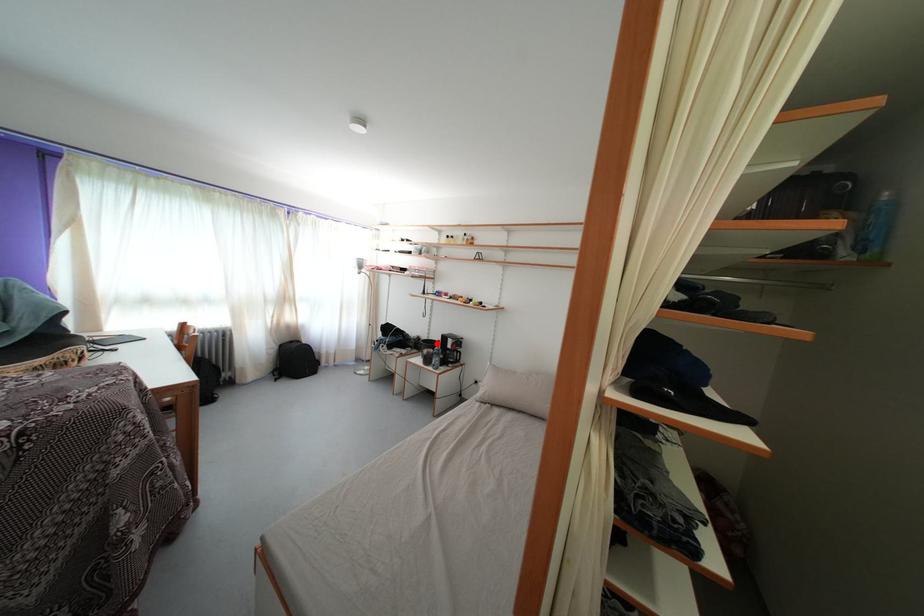
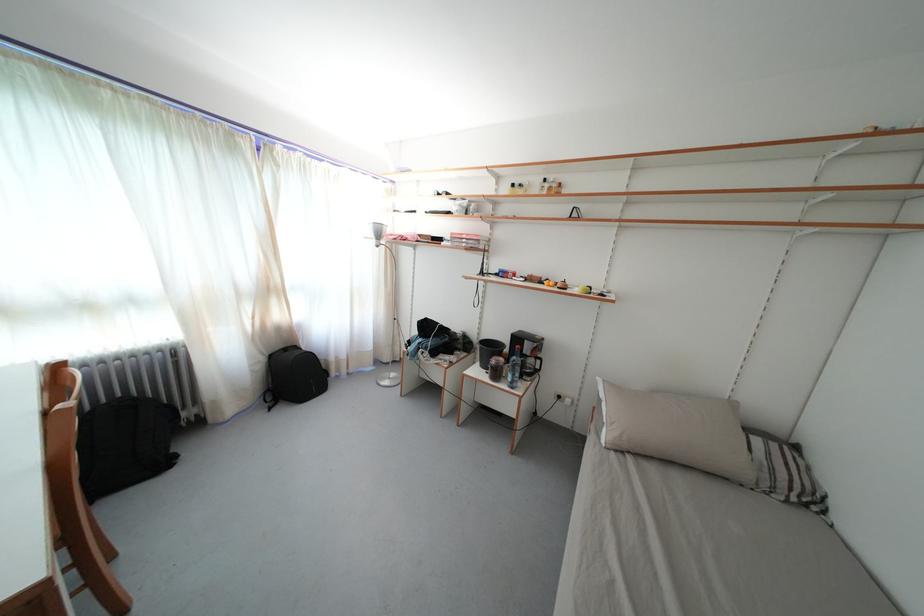
Where in the second image is the point corresponding to the highlighted location from the first image?

(491, 341)